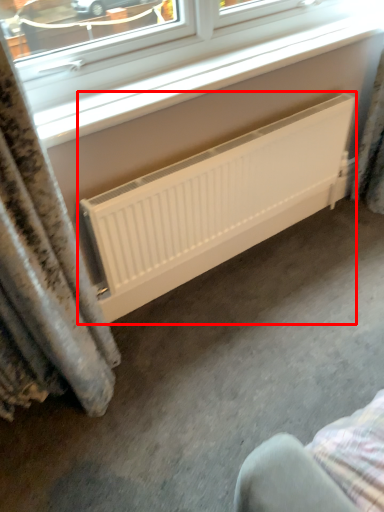
Question: Considering the relative positions of radiator (annotated by the red box) and window in the image provided, where is radiator (annotated by the red box) located with respect to the staircase?

Choices:
 (A) left
 (B) right

Answer: (B)